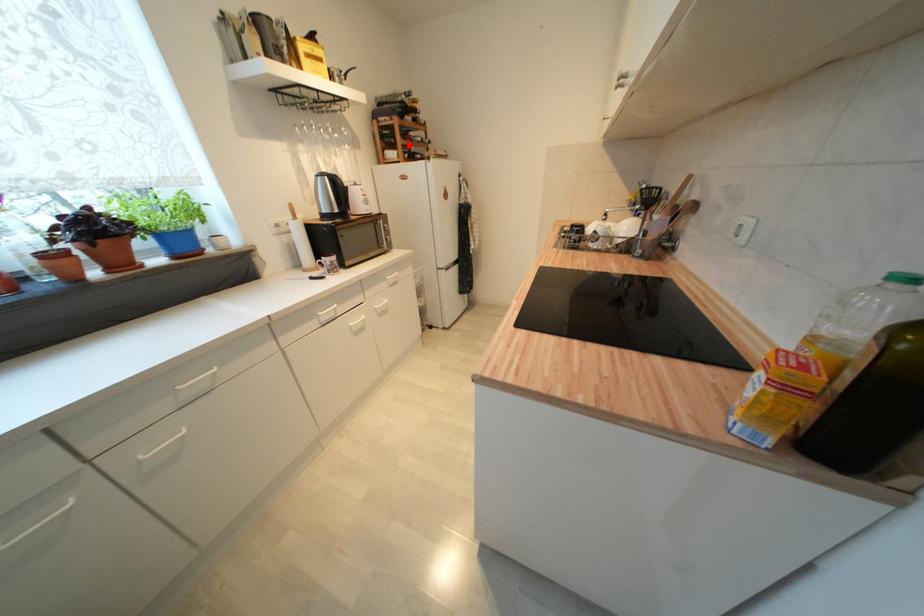
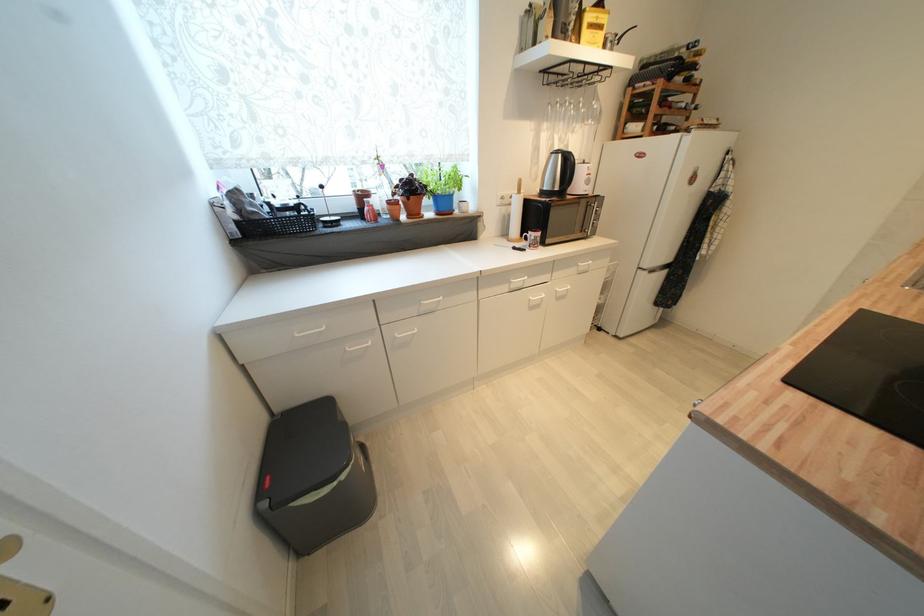
Where in the second image is the point corresponding to the highlighted location from the first image?

(664, 114)